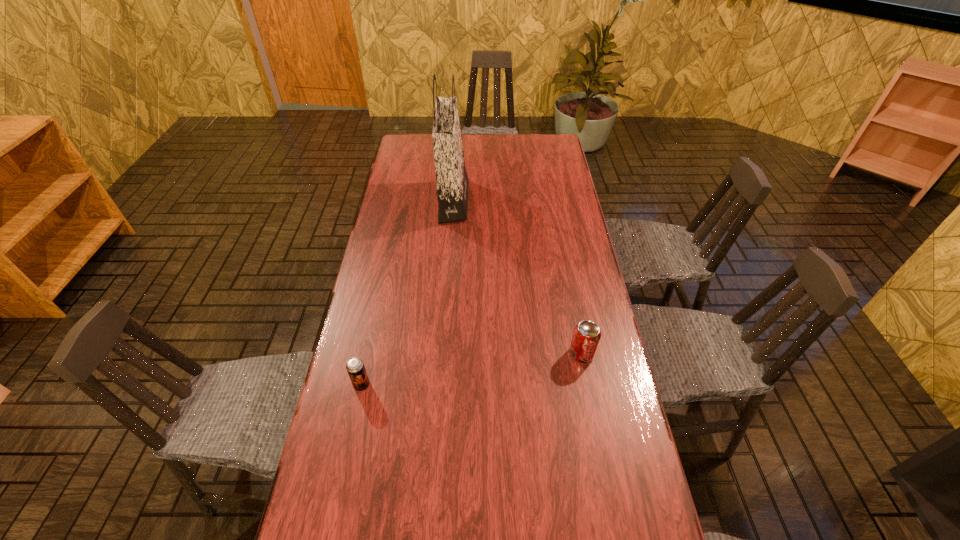
The image size is (960, 540). I want to click on object that is the second nearest to the second object from right to left, so pos(355,367).

Where is `object that is the nearest to the beer can`? object that is the nearest to the beer can is located at coordinates (586, 336).

Identify the location of free space that satisfies the following two spatial constraints: 1. on the back side of the rightmost object; 2. on the front of the tallest object with the design. Image resolution: width=960 pixels, height=540 pixels. (553, 201).

I want to click on free space that satisfies the following two spatial constraints: 1. on the front of the second nearest object with the design; 2. on the right side of the second object from right to left, so click(x=443, y=354).

You are a GUI agent. You are given a task and a screenshot of the screen. Output one action in this format:
    pyautogui.click(x=<x>, y=<y>)
    Task: Click on the blank space that satisfies the following two spatial constraints: 1. on the front of the tallest object with the design; 2. on the front side of the beer can
    This screenshot has height=540, width=960.
    Given the screenshot: What is the action you would take?
    pyautogui.click(x=441, y=385)